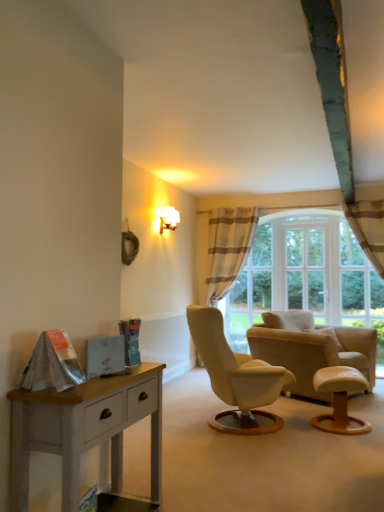
Question: Considering the relative sizes of beige leather chair at center and white ribbed radiator at center in the image provided, is beige leather chair at center shorter than white ribbed radiator at center?

Choices:
 (A) yes
 (B) no

Answer: (A)

Question: Is beige leather chair at center facing away from white ribbed radiator at center?

Choices:
 (A) no
 (B) yes

Answer: (A)

Question: From the image's perspective, is beige leather chair at center located above white ribbed radiator at center?

Choices:
 (A) yes
 (B) no

Answer: (A)

Question: Is beige leather chair at center next to white ribbed radiator at center and touching it?

Choices:
 (A) no
 (B) yes

Answer: (A)

Question: Is beige leather chair at center not inside white ribbed radiator at center?

Choices:
 (A) no
 (B) yes

Answer: (B)

Question: Can you confirm if beige leather chair at center is taller than white ribbed radiator at center?

Choices:
 (A) no
 (B) yes

Answer: (A)

Question: From a real-world perspective, is light brown wooden stool at lower right over white painted wood nightstand at lower left?

Choices:
 (A) no
 (B) yes

Answer: (A)

Question: From the image's perspective, would you say light brown wooden stool at lower right is shown under white painted wood nightstand at lower left?

Choices:
 (A) yes
 (B) no

Answer: (A)

Question: Is light brown wooden stool at lower right directly adjacent to white painted wood nightstand at lower left?

Choices:
 (A) yes
 (B) no

Answer: (B)

Question: Is light brown wooden stool at lower right closer to the viewer compared to white painted wood nightstand at lower left?

Choices:
 (A) yes
 (B) no

Answer: (B)

Question: Is light brown wooden stool at lower right surrounding white painted wood nightstand at lower left?

Choices:
 (A) yes
 (B) no

Answer: (B)

Question: Does light brown wooden stool at lower right have a larger size compared to white painted wood nightstand at lower left?

Choices:
 (A) yes
 (B) no

Answer: (B)

Question: Is white glass window at center looking in the opposite direction of light brown wooden stool at lower right?

Choices:
 (A) yes
 (B) no

Answer: (B)